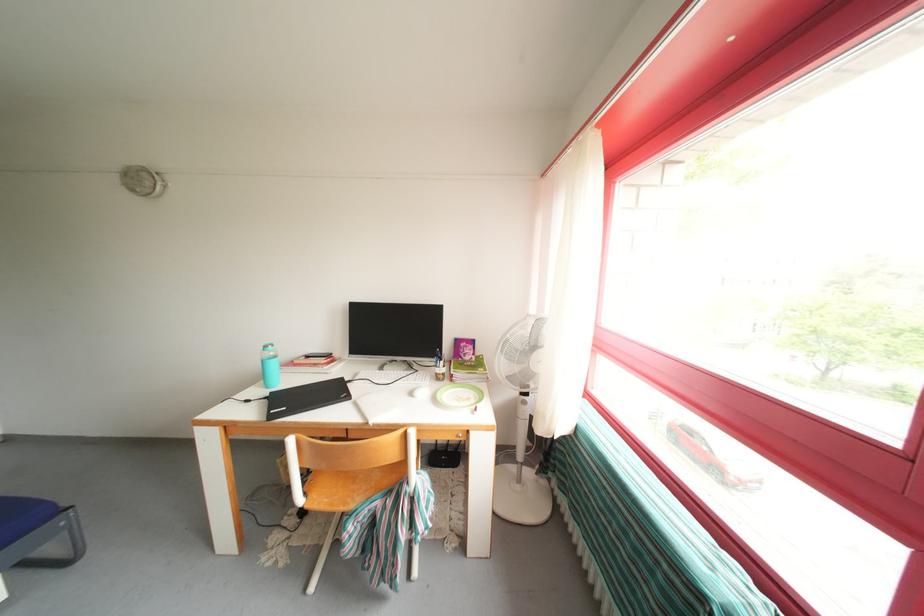
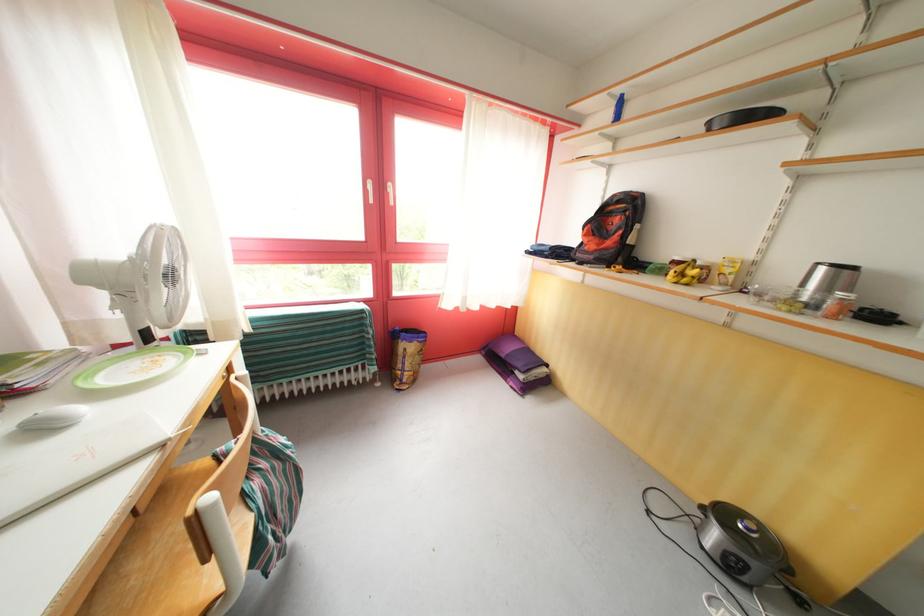
The point at (480, 394) is marked in the first image. Where is the corresponding point in the second image?

(128, 363)